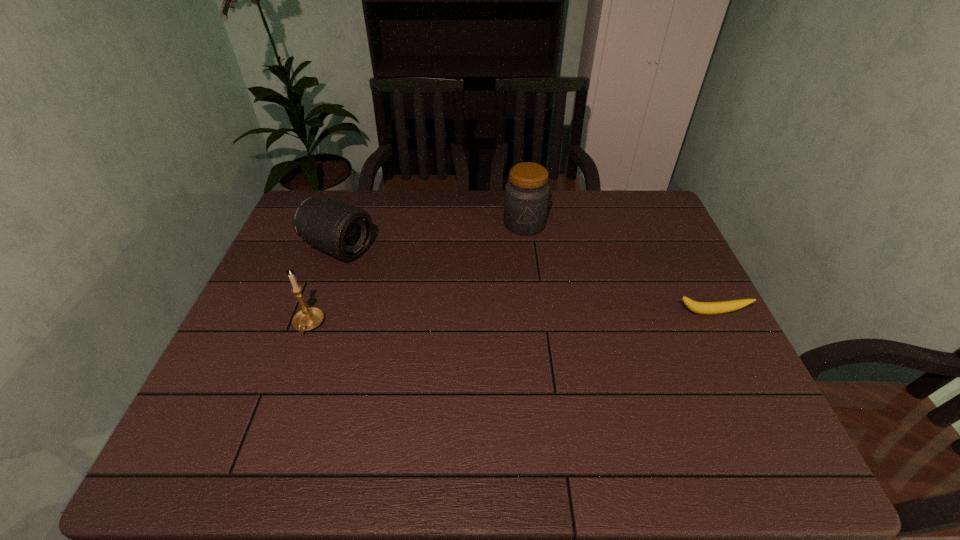
Locate an element on the screen. Image resolution: width=960 pixels, height=540 pixels. candle holder is located at coordinates (309, 318).

Identify the location of the rightmost object. The height and width of the screenshot is (540, 960). (704, 308).

At what (x,y) coordinates should I click in order to perform the action: click on the shortest object. Please return your answer as a coordinate pair (x, y). Looking at the image, I should click on (704, 308).

At what (x,y) coordinates should I click in order to perform the action: click on jar. Please return your answer as a coordinate pair (x, y). Looking at the image, I should click on (526, 198).

Where is `telephoto lens`? telephoto lens is located at coordinates 344,231.

Where is `vacant space located on the handle side of the candle holder`? This screenshot has width=960, height=540. vacant space located on the handle side of the candle holder is located at coordinates (276, 415).

Image resolution: width=960 pixels, height=540 pixels. Find the location of `free spot located 0.180m on the upward curve of the shortest object`. free spot located 0.180m on the upward curve of the shortest object is located at coordinates (742, 376).

The width and height of the screenshot is (960, 540). Identify the location of blank area located on the surface of the second object from right to left near the warning symbol. (521, 313).

Where is `vacant space located on the surface of the second object from right to left near the warning symbol`? This screenshot has height=540, width=960. vacant space located on the surface of the second object from right to left near the warning symbol is located at coordinates (521, 304).

You are a GUI agent. You are given a task and a screenshot of the screen. Output one action in this format:
    pyautogui.click(x=<x>, y=<y>)
    Task: Click on the free region located 0.300m on the surface of the second object from right to left near the warning symbol
    
    Given the screenshot: What is the action you would take?
    click(521, 307)